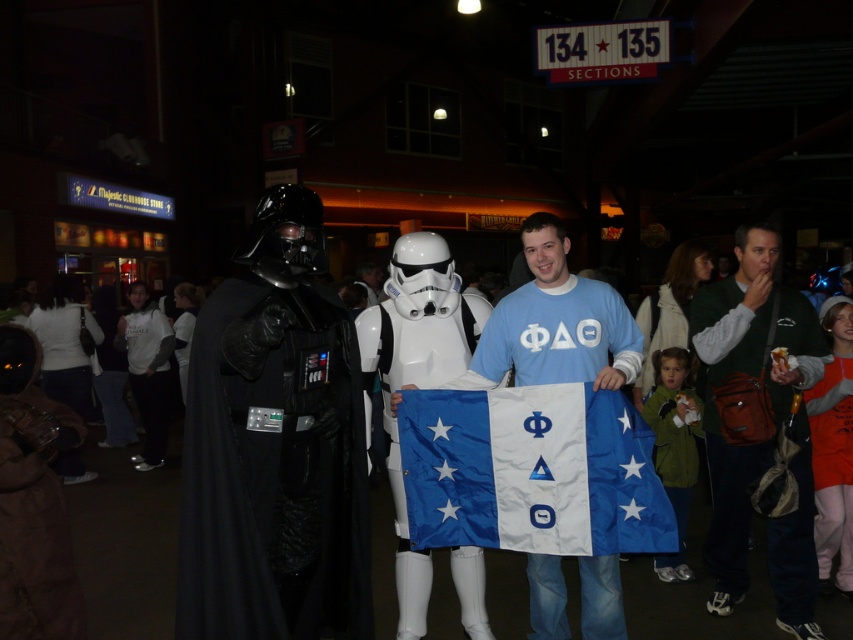
How far apart are white plastic stormtrooper at center and white matte hoodie at center?

white plastic stormtrooper at center is 4.48 meters from white matte hoodie at center.

Which is more to the right, white plastic stormtrooper at center or white matte hoodie at center?

white plastic stormtrooper at center is more to the right.

Who is more forward, [434,342] or [128,337]?

Point [434,342] is more forward.

Find the location of `white plastic stormtrooper at center`. white plastic stormtrooper at center is located at coordinates (416, 376).

Can you confirm if black leather suit at left is smaller than green fabric jacket at right?

Yes, black leather suit at left is smaller than green fabric jacket at right.

What do you see at coordinates (273, 470) in the screenshot? Image resolution: width=853 pixels, height=640 pixels. I see `black leather suit at left` at bounding box center [273, 470].

You are a GUI agent. You are given a task and a screenshot of the screen. Output one action in this format:
    pyautogui.click(x=<x>, y=<y>)
    Task: Click on the black leather suit at left
    
    Given the screenshot: What is the action you would take?
    pyautogui.click(x=273, y=470)

Does light blue cotton t-shirt at center appear under white matte hoodie at center?

No, light blue cotton t-shirt at center is not below white matte hoodie at center.

At what (x,y) coordinates should I click in order to perform the action: click on light blue cotton t-shirt at center. Please return your answer as a coordinate pair (x, y). Looking at the image, I should click on (555, 324).